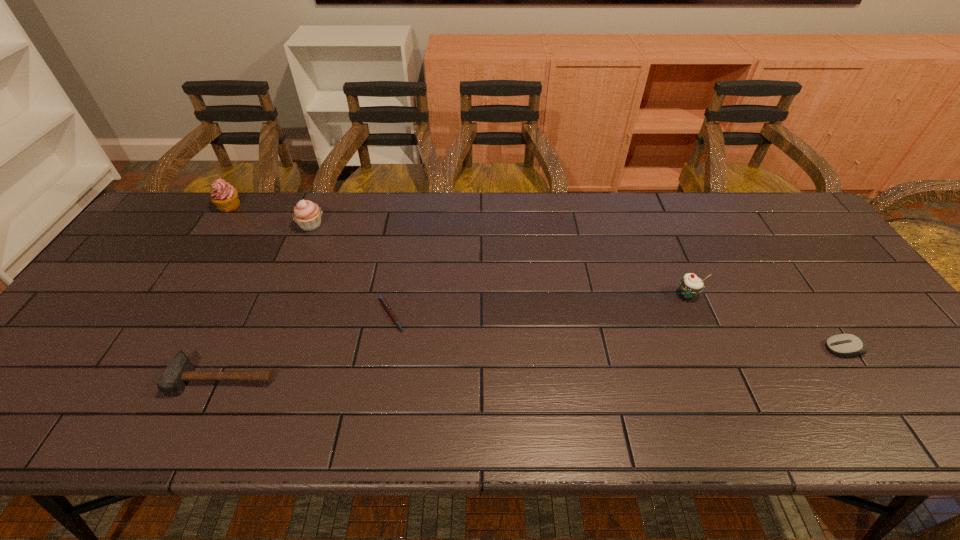
Locate an element on the screen. The image size is (960, 540). vacant space that's between the leftmost object and the pen is located at coordinates (310, 260).

You are a GUI agent. You are given a task and a screenshot of the screen. Output one action in this format:
    pyautogui.click(x=<x>, y=<y>)
    Task: Click on the vacant area that lies between the leftmost object and the second cupcake from left to right
    
    Given the screenshot: What is the action you would take?
    pyautogui.click(x=271, y=216)

Image resolution: width=960 pixels, height=540 pixels. In order to click on empty location between the leftmost object and the shortest object in this screenshot , I will do click(x=310, y=260).

Image resolution: width=960 pixels, height=540 pixels. I want to click on unoccupied area between the computer equipment and the third object from right to left, so click(617, 332).

What are the coordinates of `vacant space that's between the fifth nearest object and the farthest cupcake` in the screenshot? It's located at (271, 216).

Identify the location of vacant area between the fifth farthest object and the fourth object from left to right. (617, 332).

Locate which object ranks third in proximity to the second object from right to left. Please provide its 2D coordinates. Your answer should be formatted as a tuple, i.e. [(x, y)], where the tuple contains the x and y coordinates of a point satisfying the conditions above.

[(180, 370)]

The width and height of the screenshot is (960, 540). Find the location of `object that ranks as the closest to the hammer`. object that ranks as the closest to the hammer is located at coordinates (387, 308).

Where is `cupcake that is the second closest to the nearest object`? cupcake that is the second closest to the nearest object is located at coordinates (224, 196).

Identify the location of cupcake that is the third closest to the fifth tallest object. Image resolution: width=960 pixels, height=540 pixels. (224, 196).